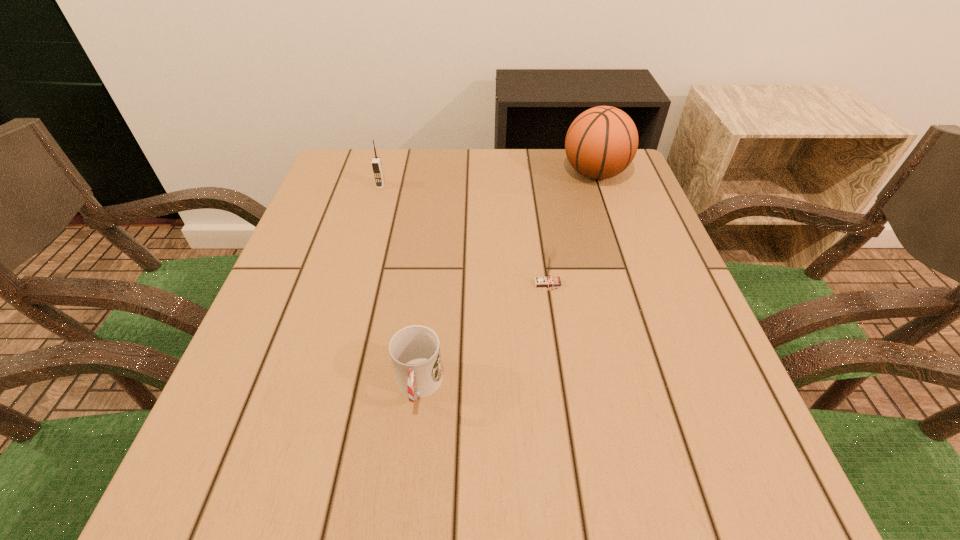
Identify the location of free region located 0.340m on the back of the matchbox. (533, 184).

I want to click on vacant space located 0.070m on the side of the second object from left to right where the handle is located, so click(x=410, y=464).

Locate an element on the screen. The height and width of the screenshot is (540, 960). basketball at the far edge is located at coordinates (601, 142).

Where is `cellular telephone positioned at the far edge`? This screenshot has height=540, width=960. cellular telephone positioned at the far edge is located at coordinates (376, 162).

Find the location of `object positioned at the left edge`. object positioned at the left edge is located at coordinates point(376,162).

Locate an element on the screen. object that is at the right edge is located at coordinates (601, 142).

The height and width of the screenshot is (540, 960). Identify the location of object that is at the far left corner. (376, 162).

Locate an element on the screen. object that is at the far right corner is located at coordinates (601, 142).

Where is `free space at the far edge of the desktop`? This screenshot has width=960, height=540. free space at the far edge of the desktop is located at coordinates (534, 198).

Locate an element on the screen. vacant space at the left edge is located at coordinates (267, 392).